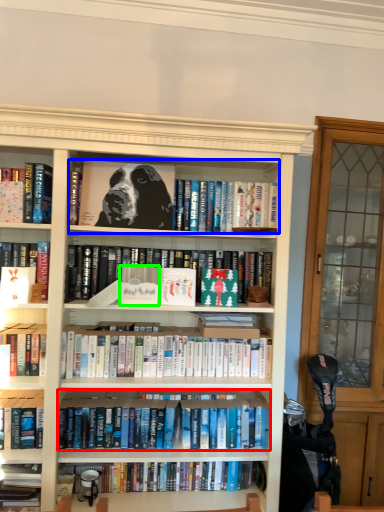
Question: Estimate the real-world distances between objects in this image. Which object is closer to book (highlighted by a red box), book (highlighted by a blue box) or paperback book (highlighted by a green box)?

Choices:
 (A) book
 (B) paperback book

Answer: (B)